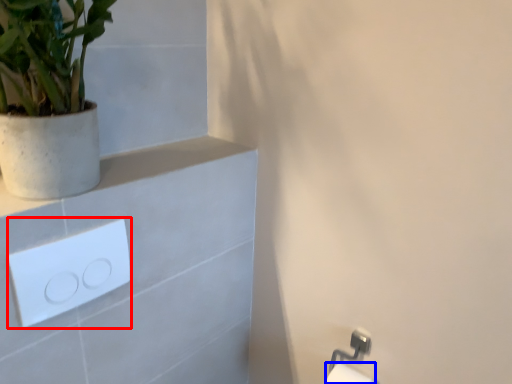
Question: Which object is closer to the camera taking this photo, light switch (highlighted by a red box) or toilet paper (highlighted by a blue box)?

Choices:
 (A) light switch
 (B) toilet paper

Answer: (A)